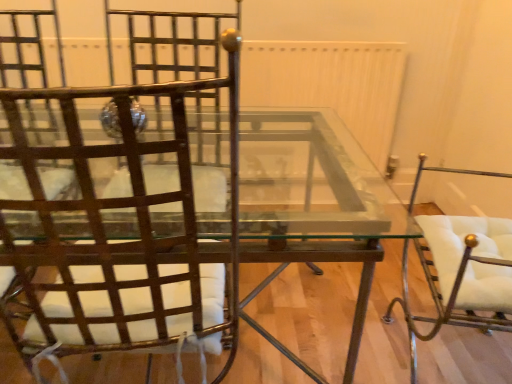
Image resolution: width=512 pixels, height=384 pixels. Describe the element at coordinates (454, 297) in the screenshot. I see `white leather chair at right, which is counted as the second chair, starting from the left` at that location.

Where is `white leather chair at right, which is counted as the second chair, starting from the left`? This screenshot has width=512, height=384. white leather chair at right, which is counted as the second chair, starting from the left is located at coordinates (454, 297).

Is white leather chair at right, which is counted as the second chair, starting from the left, further to the viewer compared to metallic brown chair at left, acting as the second chair starting from the right?

Yes, it is.

Is there a large distance between white leather chair at right, which is counted as the first chair, starting from the right, and metallic brown chair at left, marked as the 1th chair in a left-to-right arrangement?

That's not correct — white leather chair at right, which is counted as the first chair, starting from the right, is a little close to metallic brown chair at left, marked as the 1th chair in a left-to-right arrangement.

From a real-world perspective, is white leather chair at right, which is counted as the first chair, starting from the right, physically below metallic brown chair at left, marked as the 1th chair in a left-to-right arrangement?

Yes, from a real-world perspective, white leather chair at right, which is counted as the first chair, starting from the right, is beneath metallic brown chair at left, marked as the 1th chair in a left-to-right arrangement.

Which is nearer, [447,225] or [1,151]?

Clearly, point [447,225] is more distant from the camera than point [1,151].

Looking at this image, from the image's perspective, is metallic brown chair at left, marked as the 1th chair in a left-to-right arrangement, located above or below clear glass table at center?

Based on their image positions, metallic brown chair at left, marked as the 1th chair in a left-to-right arrangement, is located above clear glass table at center.

Which object is further away from the camera taking this photo, metallic brown chair at left, marked as the 1th chair in a left-to-right arrangement, or clear glass table at center?

A: clear glass table at center is further from the camera.

Looking at their sizes, would you say metallic brown chair at left, acting as the second chair starting from the right, is wider or thinner than clear glass table at center?

In the image, metallic brown chair at left, acting as the second chair starting from the right, appears to be more narrow than clear glass table at center.

Is metallic brown chair at left, acting as the second chair starting from the right, inside or outside of clear glass table at center?

metallic brown chair at left, acting as the second chair starting from the right, fits inside clear glass table at center.

This screenshot has width=512, height=384. Identify the location of table behind the white leather chair at right, which is counted as the second chair, starting from the left. (314, 198).

How distant is white leather chair at right, which is counted as the second chair, starting from the left, from clear glass table at center?

19.62 inches.

Is white leather chair at right, which is counted as the second chair, starting from the left, wider or thinner than clear glass table at center?

Clearly, white leather chair at right, which is counted as the second chair, starting from the left, has less width compared to clear glass table at center.

Looking at this image, is white leather chair at right, which is counted as the second chair, starting from the left, oriented away from clear glass table at center?

white leather chair at right, which is counted as the second chair, starting from the left, does not have its back to clear glass table at center.

Are clear glass table at center and metallic brown chair at left, acting as the second chair starting from the right, located far from each other?

No, there isn't a large distance between clear glass table at center and metallic brown chair at left, acting as the second chair starting from the right.

Is clear glass table at center in front of or behind metallic brown chair at left, marked as the 1th chair in a left-to-right arrangement, in the image?

clear glass table at center is positioned farther from the viewer than metallic brown chair at left, marked as the 1th chair in a left-to-right arrangement.

Does clear glass table at center have a lesser height compared to metallic brown chair at left, marked as the 1th chair in a left-to-right arrangement?

Correct, clear glass table at center is not as tall as metallic brown chair at left, marked as the 1th chair in a left-to-right arrangement.

Could you tell me if clear glass table at center is facing metallic brown chair at left, marked as the 1th chair in a left-to-right arrangement?

Yes, clear glass table at center is turned towards metallic brown chair at left, marked as the 1th chair in a left-to-right arrangement.

Which of these two, metallic brown chair at left, marked as the 1th chair in a left-to-right arrangement, or white leather chair at right, which is counted as the first chair, starting from the right, is smaller?

white leather chair at right, which is counted as the first chair, starting from the right.

Considering the relative positions of metallic brown chair at left, marked as the 1th chair in a left-to-right arrangement, and white leather chair at right, which is counted as the second chair, starting from the left, in the image provided, is metallic brown chair at left, marked as the 1th chair in a left-to-right arrangement, in front of white leather chair at right, which is counted as the second chair, starting from the left,?

Yes.

Considering the positions of points (116, 279) and (465, 171), is point (116, 279) farther from camera compared to point (465, 171)?

No.

Measure the distance between metallic brown chair at left, marked as the 1th chair in a left-to-right arrangement, and white leather chair at right, which is counted as the first chair, starting from the right.

metallic brown chair at left, marked as the 1th chair in a left-to-right arrangement, is 31.56 inches away from white leather chair at right, which is counted as the first chair, starting from the right.

Between clear glass table at center and white leather chair at right, which is counted as the second chair, starting from the left, which one has less height?

Standing shorter between the two is clear glass table at center.

How far apart are clear glass table at center and white leather chair at right, which is counted as the first chair, starting from the right?

clear glass table at center and white leather chair at right, which is counted as the first chair, starting from the right, are 19.62 inches apart from each other.

Is clear glass table at center far away from white leather chair at right, which is counted as the second chair, starting from the left?

No, clear glass table at center is not far away from white leather chair at right, which is counted as the second chair, starting from the left.

This screenshot has height=384, width=512. I want to click on chair located above the white leather chair at right, which is counted as the first chair, starting from the right (from a real-world perspective), so click(119, 242).

From the image's perspective, count 1st chairs upward from the clear glass table at center and point to it. Please provide its 2D coordinates.

[(119, 242)]

Estimate the real-world distances between objects in this image. Which object is closer to white leather chair at right, which is counted as the second chair, starting from the left, metallic brown chair at left, acting as the second chair starting from the right, or clear glass table at center?

clear glass table at center.

Looking at the image, which one is located further to clear glass table at center, metallic brown chair at left, acting as the second chair starting from the right, or white leather chair at right, which is counted as the first chair, starting from the right?

white leather chair at right, which is counted as the first chair, starting from the right, lies further to clear glass table at center than the other object.

From the image, which object appears to be farther from metallic brown chair at left, acting as the second chair starting from the right, clear glass table at center or white leather chair at right, which is counted as the first chair, starting from the right?

white leather chair at right, which is counted as the first chair, starting from the right, is positioned further to the anchor metallic brown chair at left, acting as the second chair starting from the right.

Looking at the image, which one is located closer to metallic brown chair at left, acting as the second chair starting from the right, white leather chair at right, which is counted as the first chair, starting from the right, or clear glass table at center?

clear glass table at center.

Which object lies further to the anchor point clear glass table at center, white leather chair at right, which is counted as the first chair, starting from the right, or metallic brown chair at left, marked as the 1th chair in a left-to-right arrangement?

white leather chair at right, which is counted as the first chair, starting from the right, lies further to clear glass table at center than the other object.

Which object lies nearer to the anchor point white leather chair at right, which is counted as the second chair, starting from the left, clear glass table at center or metallic brown chair at left, marked as the 1th chair in a left-to-right arrangement?

clear glass table at center is closer to white leather chair at right, which is counted as the second chair, starting from the left.

Locate an element on the screen. This screenshot has height=384, width=512. table between metallic brown chair at left, acting as the second chair starting from the right, and white leather chair at right, which is counted as the first chair, starting from the right is located at coordinates (314, 198).